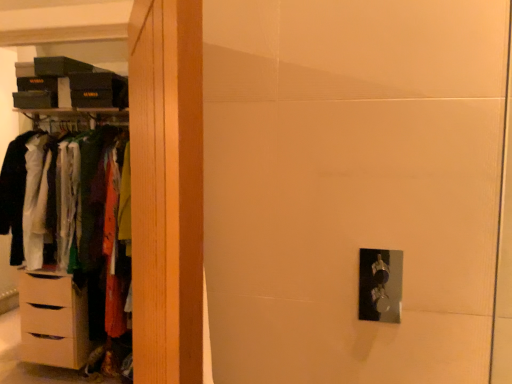
Question: Is beige matte chest of drawers at left oriented towards wooden wardrobe at left?

Choices:
 (A) no
 (B) yes

Answer: (A)

Question: Does beige matte chest of drawers at left come behind wooden wardrobe at left?

Choices:
 (A) no
 (B) yes

Answer: (B)

Question: Is wooden wardrobe at left located within beige matte chest of drawers at left?

Choices:
 (A) yes
 (B) no

Answer: (B)

Question: Is beige matte chest of drawers at left facing away from wooden wardrobe at left?

Choices:
 (A) no
 (B) yes

Answer: (A)

Question: From a real-world perspective, is beige matte chest of drawers at left physically above wooden wardrobe at left?

Choices:
 (A) no
 (B) yes

Answer: (A)

Question: From a real-world perspective, is beige matte chest of drawers at left positioned above or below matte wood dresser at left?

Choices:
 (A) above
 (B) below

Answer: (B)

Question: Considering the positions of beige matte chest of drawers at left and matte wood dresser at left in the image, is beige matte chest of drawers at left taller or shorter than matte wood dresser at left?

Choices:
 (A) tall
 (B) short

Answer: (B)

Question: In terms of width, does beige matte chest of drawers at left look wider or thinner when compared to matte wood dresser at left?

Choices:
 (A) thin
 (B) wide

Answer: (B)

Question: Based on their sizes in the image, would you say beige matte chest of drawers at left is bigger or smaller than matte wood dresser at left?

Choices:
 (A) big
 (B) small

Answer: (B)

Question: From a real-world perspective, relative to beige matte chest of drawers at left, is wooden wardrobe at left vertically above or below?

Choices:
 (A) below
 (B) above

Answer: (B)

Question: Looking at the image, does wooden wardrobe at left seem bigger or smaller compared to beige matte chest of drawers at left?

Choices:
 (A) big
 (B) small

Answer: (B)

Question: Does point (154, 223) appear closer or farther from the camera than point (32, 340)?

Choices:
 (A) closer
 (B) farther

Answer: (A)

Question: Is wooden wardrobe at left inside or outside of beige matte chest of drawers at left?

Choices:
 (A) outside
 (B) inside

Answer: (A)

Question: From a real-world perspective, is matte wood dresser at left above or below beige matte chest of drawers at left?

Choices:
 (A) below
 (B) above

Answer: (B)

Question: Is matte wood dresser at left inside the boundaries of beige matte chest of drawers at left, or outside?

Choices:
 (A) inside
 (B) outside

Answer: (B)